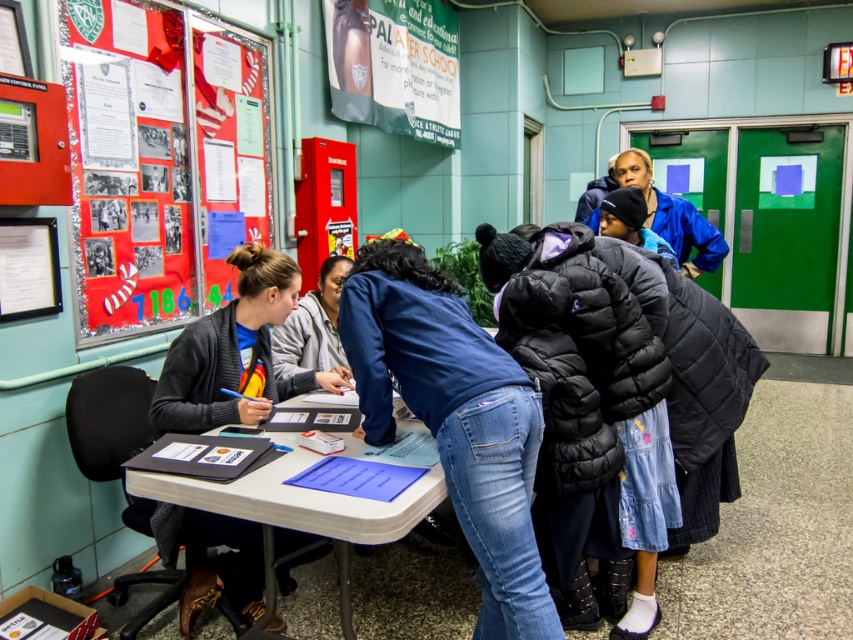
Question: Does shiny metallic poster at upper left appear over white plastic table at lower left?

Choices:
 (A) no
 (B) yes

Answer: (B)

Question: Which point is farther to the camera?

Choices:
 (A) shiny metallic poster at upper left
 (B) blue denim jeans at center

Answer: (A)

Question: Can you confirm if blue denim jeans at center is positioned above white plastic table at lower left?

Choices:
 (A) yes
 (B) no

Answer: (A)

Question: Considering the relative positions of dark gray sweater at left and white plastic table at lower left in the image provided, where is dark gray sweater at left located with respect to white plastic table at lower left?

Choices:
 (A) left
 (B) right

Answer: (A)

Question: Which object appears closest to the camera in this image?

Choices:
 (A) blue denim jeans at center
 (B) shiny metallic poster at upper left
 (C) white plastic table at lower left

Answer: (C)

Question: Among these points, which one is farthest from the camera?

Choices:
 (A) (131, 476)
 (B) (457, 108)
 (C) (248, 563)
 (D) (93, 10)

Answer: (B)